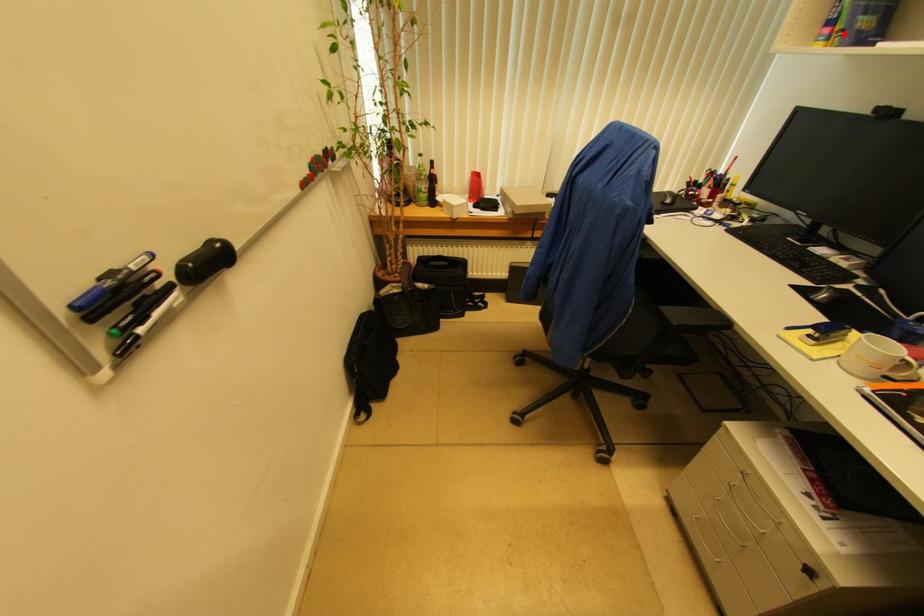
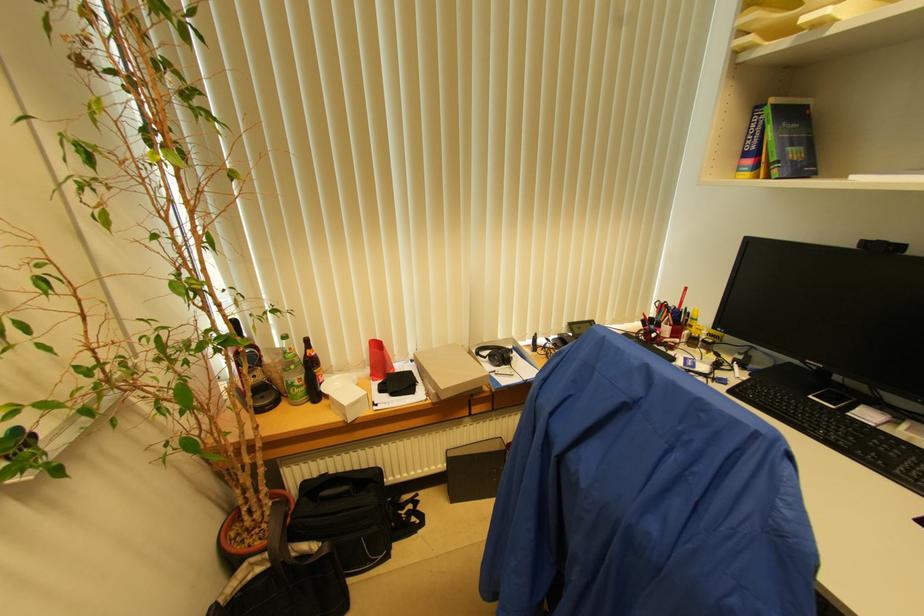
Question: A red point is marked in image1. In image2, is the corresponding 3D point closer to the camera or farther? Reply with the corresponding letter.

Choices:
 (A) The corresponding 3D point is closer.
 (B) The corresponding 3D point is farther.

Answer: (A)